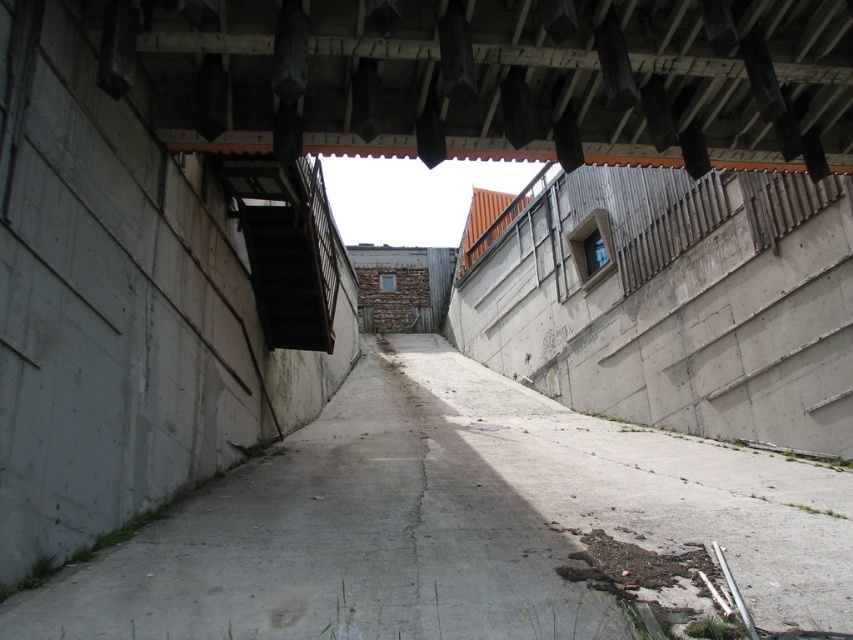
Question: Which point is farther from the camera taking this photo?

Choices:
 (A) (428, 422)
 (B) (326, 246)

Answer: (A)

Question: Considering the relative positions of concrete ceiling at upper center and dark gray concrete stairs at upper left in the image provided, where is concrete ceiling at upper center located with respect to dark gray concrete stairs at upper left?

Choices:
 (A) above
 (B) below

Answer: (A)

Question: Estimate the real-world distances between objects in this image. Which object is closer to the concrete at center?

Choices:
 (A) concrete ceiling at upper center
 (B) dark gray concrete stairs at upper left

Answer: (B)

Question: Which object is positioned farthest from the concrete at center?

Choices:
 (A) concrete ceiling at upper center
 (B) dark gray concrete stairs at upper left

Answer: (A)

Question: Can you confirm if concrete ceiling at upper center is thinner than dark gray concrete stairs at upper left?

Choices:
 (A) no
 (B) yes

Answer: (A)

Question: Observing the image, what is the correct spatial positioning of concrete at center in reference to dark gray concrete stairs at upper left?

Choices:
 (A) left
 (B) right

Answer: (B)